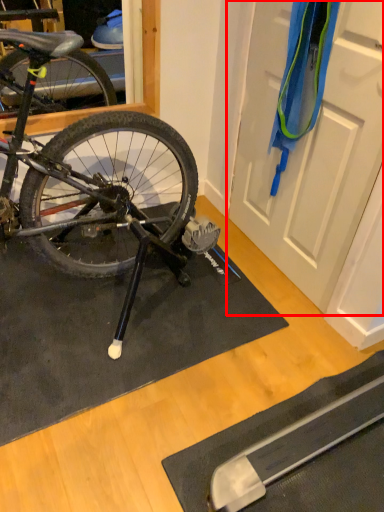
Question: Observing the image, what is the correct spatial positioning of door (annotated by the red box) in reference to doormat?

Choices:
 (A) left
 (B) right

Answer: (B)